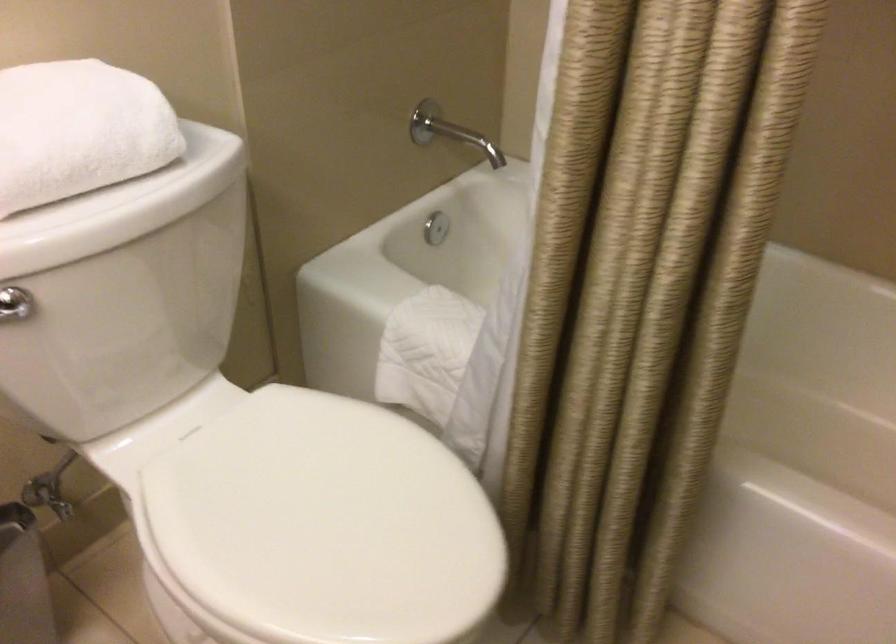
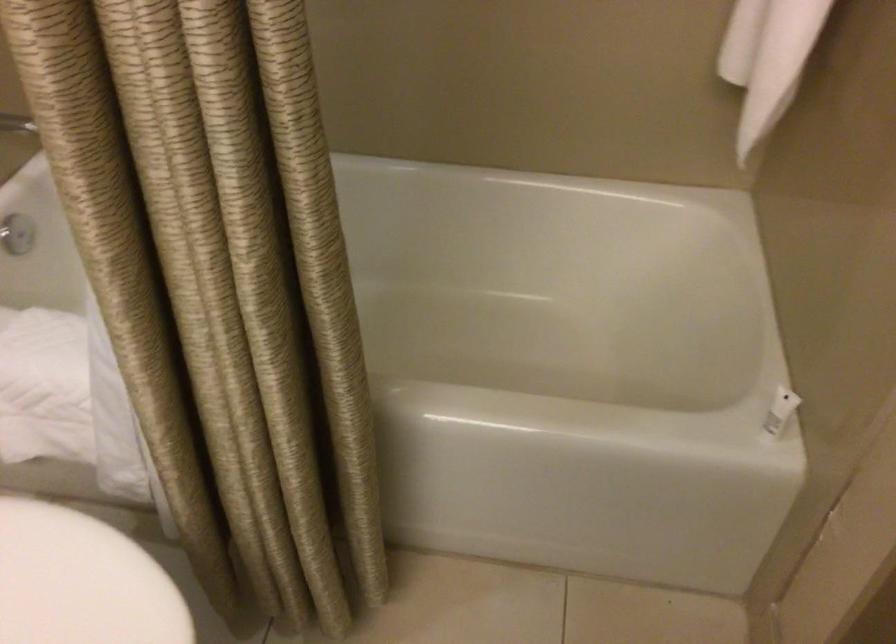
Consider the image. What movement of the cameraman would produce the second image?

The cameraman moved toward right, forward.